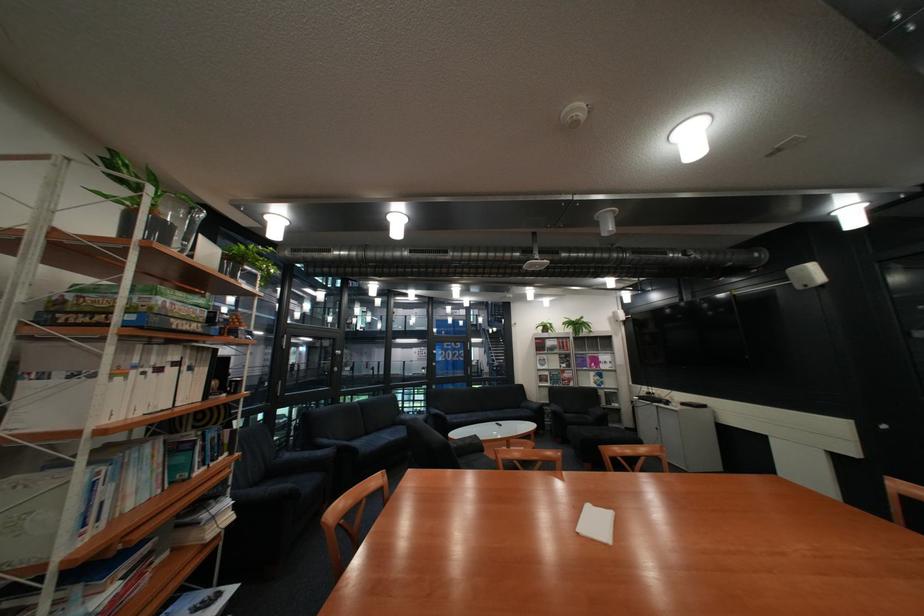
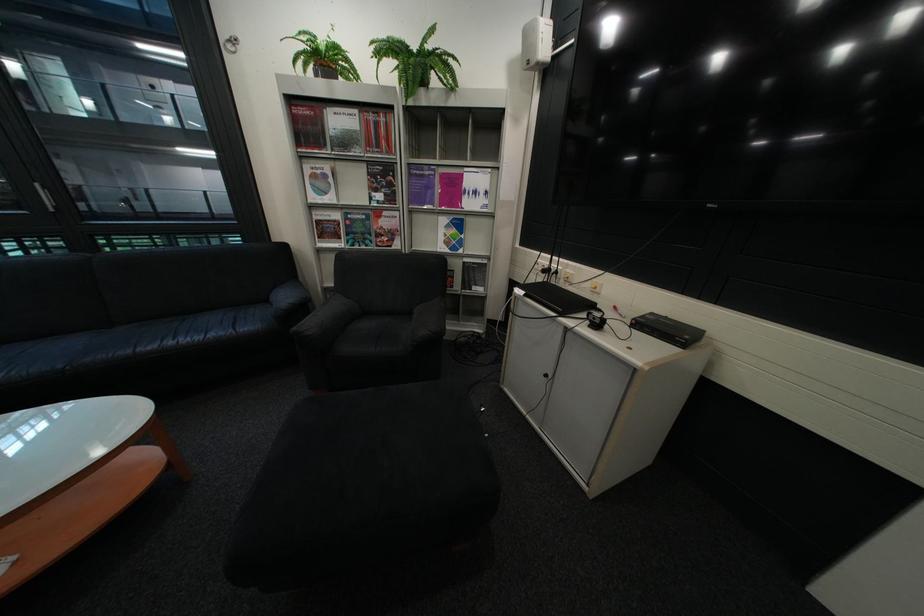
Find the pixel in the second image that matches (664,392) in the first image.

(563, 270)